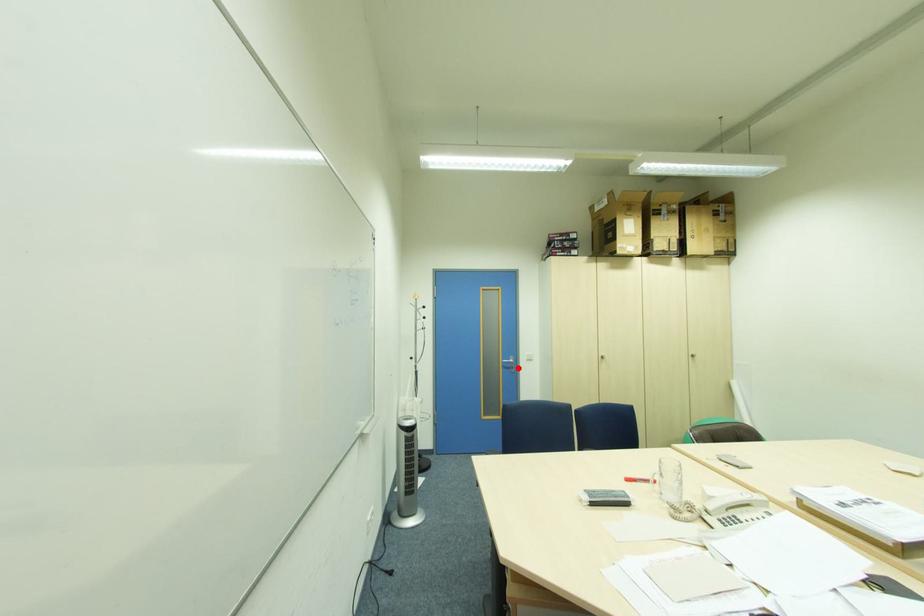
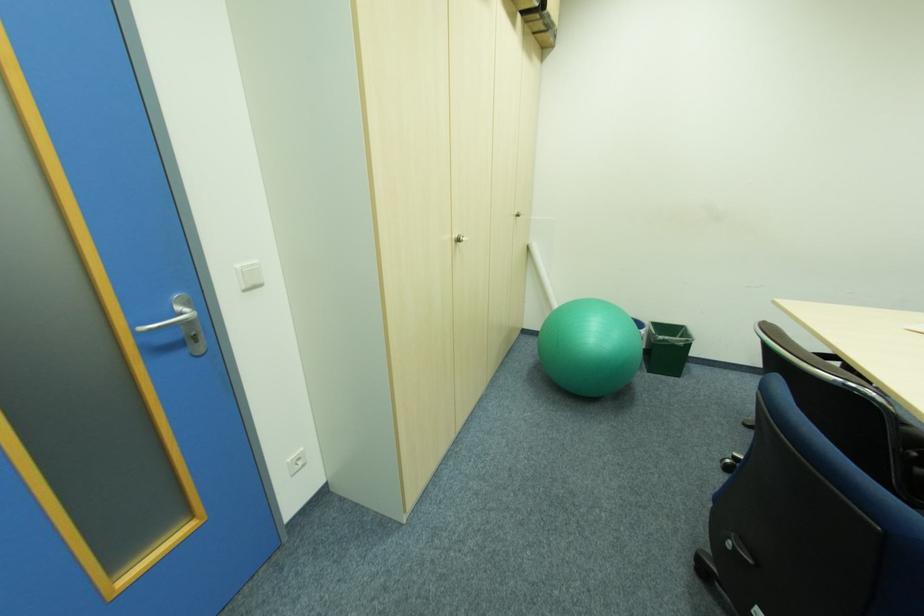
Find the pixel in the second image that matches the highlighted location in the first image.

(200, 339)